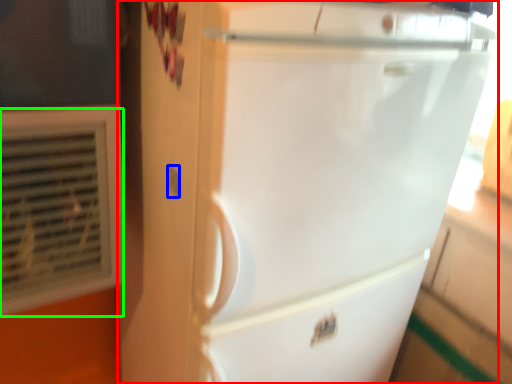
Question: Estimate the real-world distances between objects in this image. Which object is farther from refrigerator (highlighted by a red box), electric outlet (highlighted by a blue box) or air conditioning (highlighted by a green box)?

Choices:
 (A) electric outlet
 (B) air conditioning

Answer: (A)